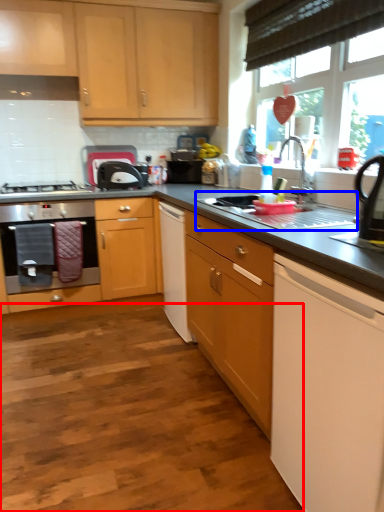
Question: Which point is further to the camera, plain (highlighted by a red box) or sink (highlighted by a blue box)?

Choices:
 (A) plain
 (B) sink

Answer: (B)